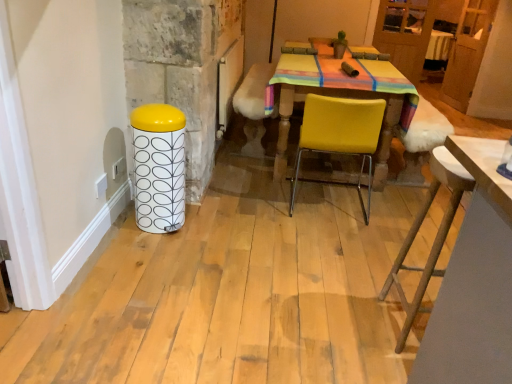
The width and height of the screenshot is (512, 384). I want to click on free space to the back side of wooden table at lower right, so click(371, 276).